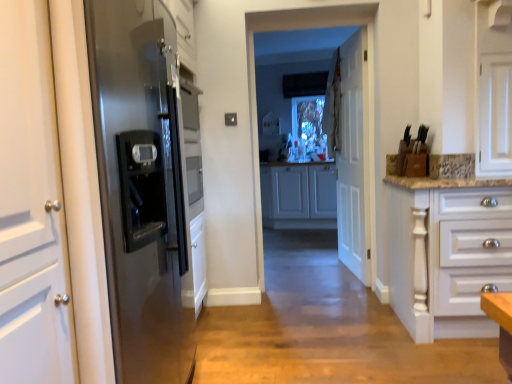
This screenshot has width=512, height=384. What do you see at coordinates (353, 157) in the screenshot?
I see `white wooden door at center` at bounding box center [353, 157].

In order to face clear glass window at center, should I rotate leftwards or rightwards?

Rotate right and turn 7.959 degrees.

Measure the distance between white sheer curtain at upper center and camera.

white sheer curtain at upper center and camera are 3.85 meters apart.

What do you see at coordinates (298, 196) in the screenshot? I see `white matte cabinet at center, which ranks as the 1th cabinetry in back-to-front order` at bounding box center [298, 196].

The image size is (512, 384). Find the location of `white wooden door at center`. white wooden door at center is located at coordinates (353, 157).

From the image's perspective, is stainless steel refrigerator at left above or below white glossy drawer at right, which is counted as the first cabinetry, starting from the front?

Clearly, from the image's perspective, stainless steel refrigerator at left is above white glossy drawer at right, which is counted as the first cabinetry, starting from the front.

Is the position of stainless steel refrigerator at left less distant than that of white glossy drawer at right, arranged as the 2th cabinetry when viewed from the back?

Yes, it is.

Is stainless steel refrigerator at left not close to white glossy drawer at right, arranged as the 2th cabinetry when viewed from the back?

stainless steel refrigerator at left is far away from white glossy drawer at right, arranged as the 2th cabinetry when viewed from the back.

From a real-world perspective, is stainless steel refrigerator at left above or below white glossy drawer at right, arranged as the 2th cabinetry when viewed from the back?

stainless steel refrigerator at left is situated higher than white glossy drawer at right, arranged as the 2th cabinetry when viewed from the back, in the real world.

Between clear glass window at center and white wooden door at center, which one appears on the left side from the viewer's perspective?

Positioned to the left is clear glass window at center.

Where is `glass door lying below the white wooden door at center (from the image's perspective)`? The image size is (512, 384). glass door lying below the white wooden door at center (from the image's perspective) is located at coordinates (318, 136).

Is clear glass window at center next to white wooden door at center?

clear glass window at center and white wooden door at center are not in contact.

From a real-world perspective, is clear glass window at center on white wooden door at center?

Yes.

Consider the image. Would you consider white glossy drawer at right, arranged as the 2th cabinetry when viewed from the back, to be distant from white matte cabinet at center, which ranks as the 1th cabinetry in back-to-front order?

Yes.

Can you confirm if white glossy drawer at right, arranged as the 2th cabinetry when viewed from the back, is wider than white matte cabinet at center, which ranks as the 1th cabinetry in back-to-front order?

Yes, white glossy drawer at right, arranged as the 2th cabinetry when viewed from the back, is wider than white matte cabinet at center, which ranks as the 1th cabinetry in back-to-front order.

This screenshot has height=384, width=512. What are the coordinates of `cabinetry above the white glossy drawer at right, which is counted as the first cabinetry, starting from the front (from the image's perspective)` in the screenshot? It's located at (298, 196).

Is white glossy drawer at right, arranged as the 2th cabinetry when viewed from the back, oriented towards white matte cabinet at center, acting as the 2th cabinetry starting from the front?

No, white glossy drawer at right, arranged as the 2th cabinetry when viewed from the back, is not turned towards white matte cabinet at center, acting as the 2th cabinetry starting from the front.

Locate an element on the screen. The width and height of the screenshot is (512, 384). cabinetry that is behind the white wooden door at center is located at coordinates (298, 196).

Which object is further away from the camera, white matte cabinet at center, which ranks as the 1th cabinetry in back-to-front order, or white wooden door at center?

Positioned behind is white matte cabinet at center, which ranks as the 1th cabinetry in back-to-front order.

Considering the relative positions of white matte cabinet at center, acting as the 2th cabinetry starting from the front, and white wooden door at center in the image provided, is white matte cabinet at center, acting as the 2th cabinetry starting from the front, to the left of white wooden door at center from the viewer's perspective?

Yes.

Is white matte cabinet at center, acting as the 2th cabinetry starting from the front, thinner than white wooden door at center?

No.

From a real-world perspective, between white wooden door at center and stainless steel refrigerator at left, who is vertically higher?

white wooden door at center, from a real-world perspective.

Would you consider white wooden door at center to be distant from stainless steel refrigerator at left?

Yes, white wooden door at center and stainless steel refrigerator at left are located far from each other.

From the image's perspective, between white wooden door at center and stainless steel refrigerator at left, which one is located above?

white wooden door at center, from the image's perspective.

Which is closer to the camera, (346,88) or (129,219)?

Point (346,88) appears to be farther away from the viewer than point (129,219).

From a real-world perspective, is white matte cabinet at center, which ranks as the 1th cabinetry in back-to-front order, under white sheer curtain at upper center?

Indeed, from a real-world perspective, white matte cabinet at center, which ranks as the 1th cabinetry in back-to-front order, is positioned beneath white sheer curtain at upper center.

Is white matte cabinet at center, which ranks as the 1th cabinetry in back-to-front order, completely or partially outside of white sheer curtain at upper center?

Yes.

How many degrees apart are the facing directions of white matte cabinet at center, acting as the 2th cabinetry starting from the front, and white sheer curtain at upper center?

The angle between the facing direction of white matte cabinet at center, acting as the 2th cabinetry starting from the front, and the facing direction of white sheer curtain at upper center is 73.8 degrees.

Could you tell me if white matte cabinet at center, acting as the 2th cabinetry starting from the front, is facing white sheer curtain at upper center?

No.

Is white glossy drawer at right, which is counted as the first cabinetry, starting from the front, wider than clear glass window at center?

Yes.

Considering the relative positions of white glossy drawer at right, arranged as the 2th cabinetry when viewed from the back, and clear glass window at center in the image provided, is white glossy drawer at right, arranged as the 2th cabinetry when viewed from the back, to the right of clear glass window at center from the viewer's perspective?

Yes, white glossy drawer at right, arranged as the 2th cabinetry when viewed from the back, is to the right of clear glass window at center.

In the scene shown: What's the angular difference between white glossy drawer at right, which is counted as the first cabinetry, starting from the front, and clear glass window at center's facing directions?

180 degrees.

From a real-world perspective, who is located lower, white glossy drawer at right, which is counted as the first cabinetry, starting from the front, or clear glass window at center?

From a 3D spatial view, white glossy drawer at right, which is counted as the first cabinetry, starting from the front, is below.

The image size is (512, 384). I want to click on the 2nd cabinetry directly beneath the stainless steel refrigerator at left (from a real-world perspective), so click(x=446, y=252).

At what (x,y) coordinates should I click in order to perform the action: click on door above the clear glass window at center (from the image's perspective). Please return your answer as a coordinate pair (x, y). Looking at the image, I should click on (353, 157).

Estimate the real-world distances between objects in this image. Which object is further from white glossy drawer at right, which is counted as the first cabinetry, starting from the front, stainless steel refrigerator at left or clear glass window at center?

Based on the image, clear glass window at center appears to be further to white glossy drawer at right, which is counted as the first cabinetry, starting from the front.

Based on their spatial positions, is stainless steel refrigerator at left or white sheer curtain at upper center closer to white wooden door at center?

Based on the image, white sheer curtain at upper center appears to be nearer to white wooden door at center.

From the image, which object appears to be farther from white matte cabinet at center, which ranks as the 1th cabinetry in back-to-front order, clear glass window at center or white wooden door at center?

white wooden door at center is positioned further to the anchor white matte cabinet at center, which ranks as the 1th cabinetry in back-to-front order.

Estimate the real-world distances between objects in this image. Which object is further from stainless steel refrigerator at left, white glossy drawer at right, arranged as the 2th cabinetry when viewed from the back, or white sheer curtain at upper center?

white sheer curtain at upper center lies further to stainless steel refrigerator at left than the other object.

From the image, which object appears to be nearer to white glossy drawer at right, which is counted as the first cabinetry, starting from the front, white sheer curtain at upper center or clear glass window at center?

white sheer curtain at upper center.

Looking at the image, which one is located further to stainless steel refrigerator at left, clear glass window at center or white matte cabinet at center, acting as the 2th cabinetry starting from the front?

Among the two, clear glass window at center is located further to stainless steel refrigerator at left.

Which object lies further to the anchor point clear glass window at center, white glossy drawer at right, which is counted as the first cabinetry, starting from the front, or white wooden door at center?

white glossy drawer at right, which is counted as the first cabinetry, starting from the front, is further to clear glass window at center.

Looking at the image, which one is located closer to white sheer curtain at upper center, white glossy drawer at right, which is counted as the first cabinetry, starting from the front, or white matte cabinet at center, which ranks as the 1th cabinetry in back-to-front order?

white glossy drawer at right, which is counted as the first cabinetry, starting from the front, lies closer to white sheer curtain at upper center than the other object.

I want to click on glass door between white glossy drawer at right, arranged as the 2th cabinetry when viewed from the back, and white sheer curtain at upper center from front to back, so click(318, 136).

I want to click on curtain between white wooden door at center and white matte cabinet at center, which ranks as the 1th cabinetry in back-to-front order, in the front-back direction, so click(332, 106).

I want to click on door between stainless steel refrigerator at left and white matte cabinet at center, acting as the 2th cabinetry starting from the front, from front to back, so click(x=353, y=157).

At what (x,y) coordinates should I click in order to perform the action: click on cabinetry located between stainless steel refrigerator at left and white matte cabinet at center, which ranks as the 1th cabinetry in back-to-front order, in the depth direction. Please return your answer as a coordinate pair (x, y). The width and height of the screenshot is (512, 384). Looking at the image, I should click on (446, 252).